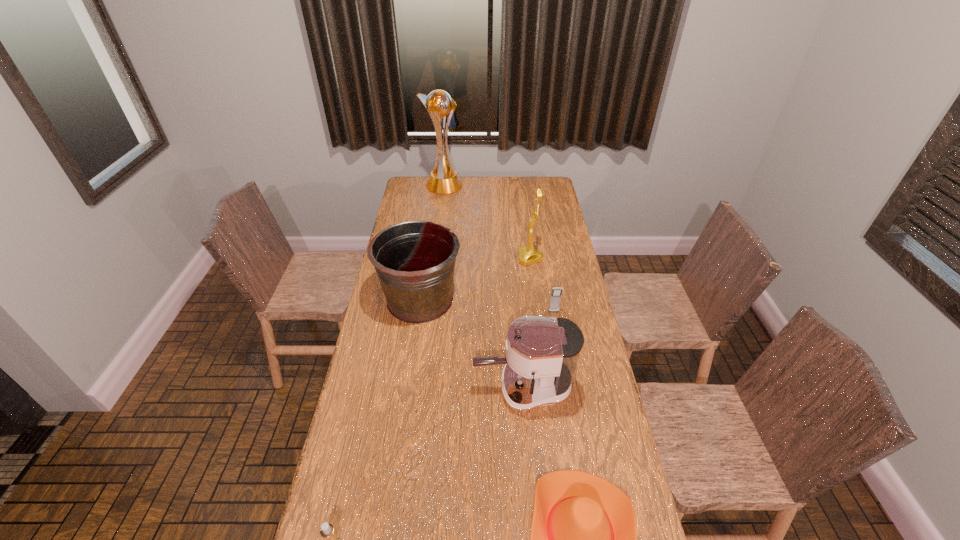
Image resolution: width=960 pixels, height=540 pixels. Find the location of `vacant region located on the front-facing side of the fifth farthest object`. vacant region located on the front-facing side of the fifth farthest object is located at coordinates (358, 388).

The image size is (960, 540). I want to click on free spot located on the front-facing side of the fifth farthest object, so pos(402,388).

The image size is (960, 540). What are the coordinates of `free region located on the front-facing side of the fifth farthest object` in the screenshot? It's located at (361, 388).

What are the coordinates of `vacant space situated on the right of the bucket` in the screenshot? It's located at (541, 300).

This screenshot has height=540, width=960. I want to click on free space located on the front-facing side of the cellular telephone, so click(x=567, y=388).

Find the location of a particular element. Image resolution: width=960 pixels, height=540 pixels. object located in the far edge section of the desktop is located at coordinates (443, 179).

I want to click on trophy located at the left edge, so click(443, 179).

Where is `bucket that is at the left edge`? This screenshot has width=960, height=540. bucket that is at the left edge is located at coordinates (415, 261).

The width and height of the screenshot is (960, 540). I want to click on award located in the right edge section of the desktop, so [528, 255].

Where is `coffee maker situated at the right edge`? This screenshot has width=960, height=540. coffee maker situated at the right edge is located at coordinates (542, 353).